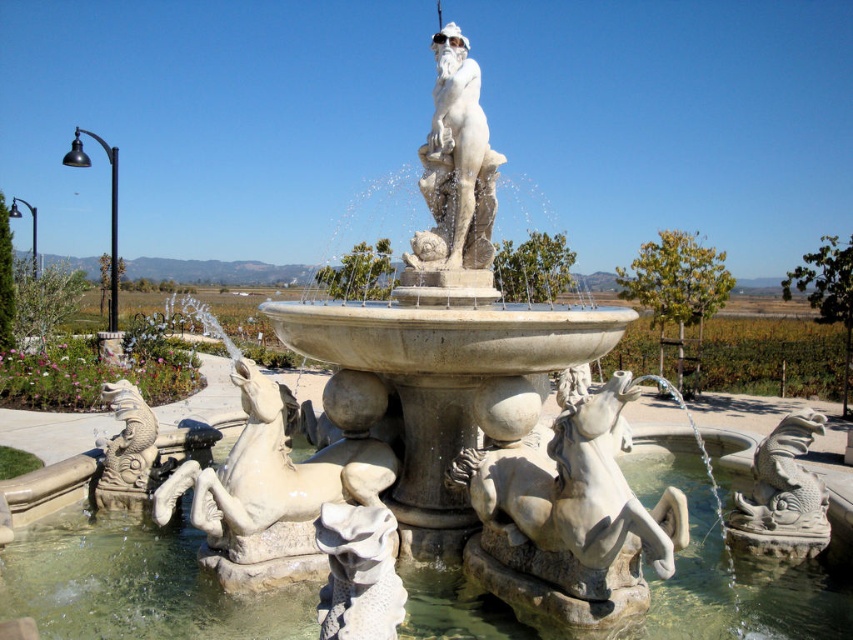
You are an artist planning to sketch the fountain. You want to ensure the white marble statue at center and the gray stone dragon at lower right are proportionally accurate. Which object should you draw larger in your sketch?

The white marble statue at center should be drawn larger than the gray stone dragon at lower right because it has a larger size compared to the gray stone dragon at lower right according to the description.

You are standing in front of the grand fountain and want to take a photo of both the white marble horse at lower center and the gray stone dragon at lower right. Which of the two objects is positioned closer to you, requiring you to adjust your camera focus accordingly?

The white marble horse at lower center is closer to the viewer than the gray stone dragon at lower right, so you should focus on it first before adjusting for the dragon in the background.

You are a tour guide leading a group around the fountain. You want to point out the distance between the white marble horse at lower center and the gray stone dragon at lower right to your visitors. How far apart are they?

The white marble horse at lower center is 1.65 meters from the gray stone dragon at lower right, so they are 1.65 meters apart.